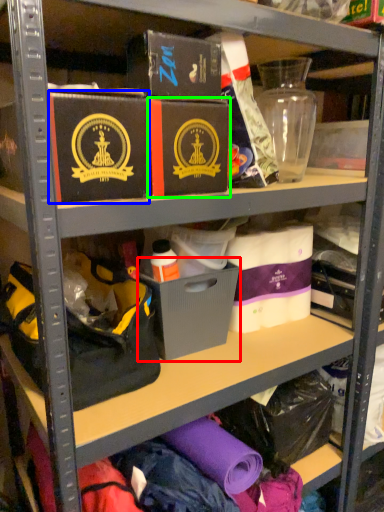
Question: Which object is positioned farthest from storage box (highlighted by a red box)? Select from box (highlighted by a blue box) and box (highlighted by a green box).

Choices:
 (A) box
 (B) box

Answer: (A)